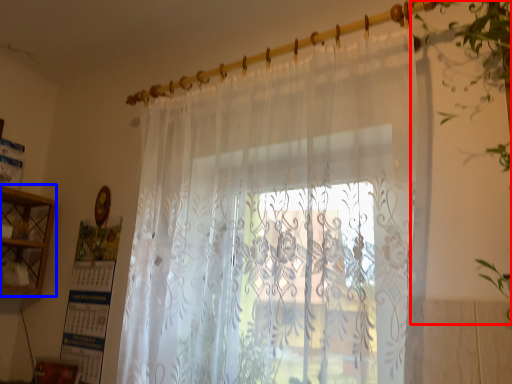
Question: Which object is closer to the camera taking this photo, vegetation (highlighted by a red box) or cabinet (highlighted by a blue box)?

Choices:
 (A) vegetation
 (B) cabinet

Answer: (A)